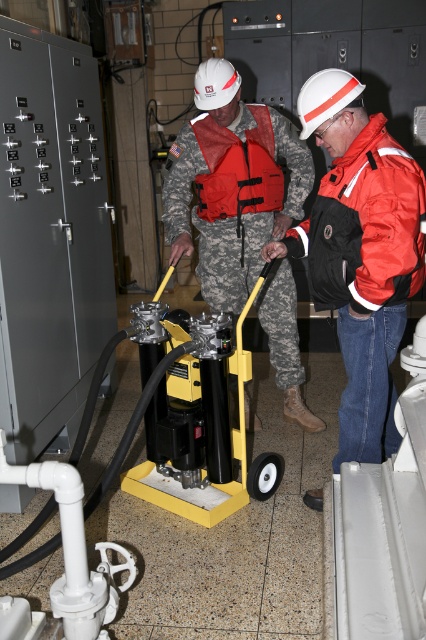
Image resolution: width=426 pixels, height=640 pixels. What do you see at coordinates (232, 184) in the screenshot?
I see `camouflage uniform at center` at bounding box center [232, 184].

Can you confirm if camouflage uniform at center is thinner than orange matte jacket at right?

No, camouflage uniform at center is not thinner than orange matte jacket at right.

Between point (245, 243) and point (347, 196), which one is positioned in front?

Point (347, 196)

What are the coordinates of `camouflage uniform at center` in the screenshot? It's located at (232, 184).

Between point (305, 150) and point (262, 120), which one is positioned behind?

Point (305, 150)

Between camouflage uniform at center and red fabric life vest at center, which one has more height?

camouflage uniform at center

Is point (187, 220) positioned before point (222, 140)?

Yes.

Identify the location of camouflage uniform at center. This screenshot has height=640, width=426. (232, 184).

Between orange matte jacket at right and red fabric life vest at center, which one is positioned higher?

red fabric life vest at center

I want to click on orange matte jacket at right, so click(x=365, y=225).

You are a GUI agent. You are given a task and a screenshot of the screen. Output one action in this format:
    pyautogui.click(x=<x>, y=<y>)
    Task: Click on the orange matte jacket at right
    The height and width of the screenshot is (640, 426).
    Given the screenshot: What is the action you would take?
    pyautogui.click(x=365, y=225)

This screenshot has width=426, height=640. I want to click on orange matte jacket at right, so click(365, 225).